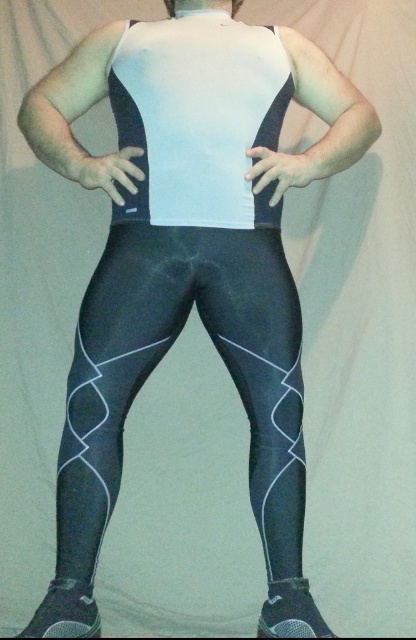
You are designing a virtual fitting room and need to place a virtual accessory at the point with coordinates point (x=160, y=358). Based on the image, which part of the outfit will this accessory be placed on?

The point (x=160, y=358) is on black spandex leggings at center, so the accessory will be placed on the black spandex leggings at center.

You are a fashion designer trying to create a matching outfit. You have the black spandex leggings at center and the white matte vest at center. Which item should you choose as the base layer if you want the base layer to be the larger piece?

The black spandex leggings at center is larger in size than the white matte vest at center, so you should choose the black spandex leggings at center as the base layer.

You are designing a mannequin for a fashion show and need to place the black spandex leggings at center and the white matte vest at center on it. What is the minimum distance you should maintain between them to ensure they don not overlap?

The minimum distance you should maintain between the black spandex leggings at center and the white matte vest at center is 11.50 inches to prevent overlapping, as they are currently 11.50 inches apart from each other.